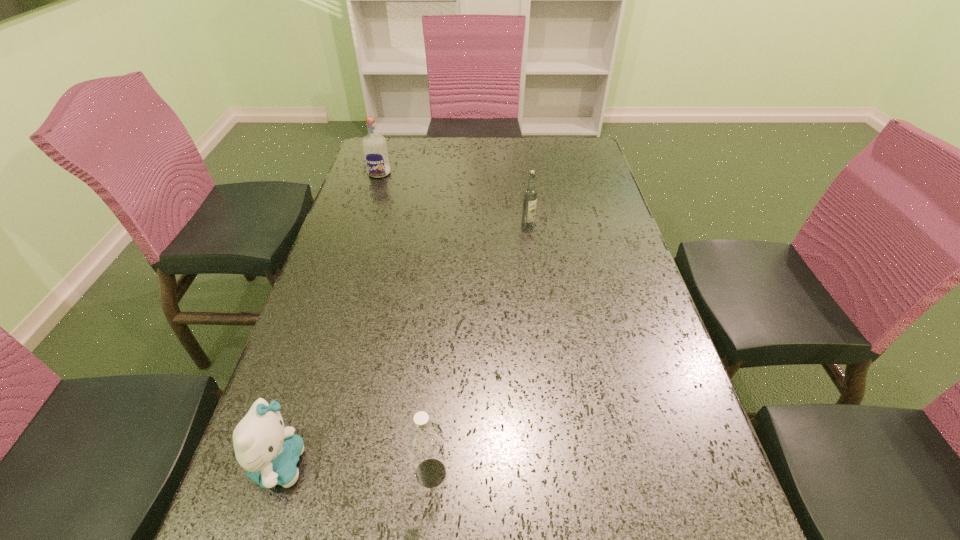
The width and height of the screenshot is (960, 540). Find the location of `the farthest object`. the farthest object is located at coordinates point(374,145).

This screenshot has width=960, height=540. Find the location of `the leftmost vodka`. the leftmost vodka is located at coordinates (374, 145).

Find the location of a particular element. This screenshot has height=540, width=960. the nearest vodka is located at coordinates (424, 439).

This screenshot has width=960, height=540. What are the coordinates of `the second object from right to left` in the screenshot? It's located at (424, 439).

This screenshot has height=540, width=960. Find the location of `the second nearest vodka`. the second nearest vodka is located at coordinates (530, 193).

At what (x,y) coordinates should I click in order to perform the action: click on the rightmost object. Please return your answer as a coordinate pair (x, y). This screenshot has height=540, width=960. Looking at the image, I should click on (530, 193).

Where is `the shortest object`? This screenshot has width=960, height=540. the shortest object is located at coordinates pos(269,452).

Locate an element on the screen. The image size is (960, 540). vacant region located 0.390m on the label of the farthest object is located at coordinates (352, 259).

At what (x,y) coordinates should I click in order to perform the action: click on free space located 0.190m on the front label of the third object from left to right. Please return your answer as a coordinate pair (x, y). This screenshot has height=540, width=960. Looking at the image, I should click on tap(559, 473).

Locate an element on the screen. free space located on the label of the rightmost vodka is located at coordinates (542, 341).